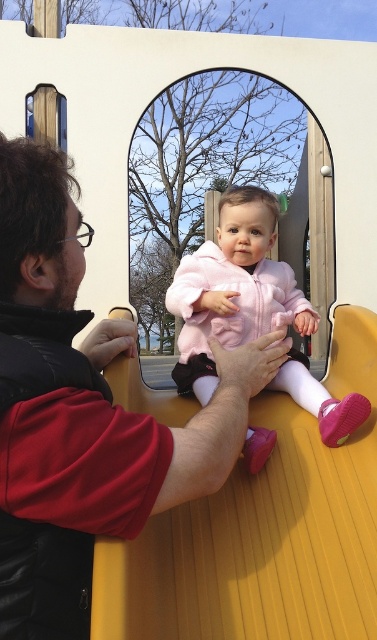
Question: Among these points, which one is nearest to the camera?

Choices:
 (A) (203, 625)
 (B) (73, 385)
 (C) (346, 404)

Answer: (B)

Question: Does matte black jacket at left appear over matte yellow slide at center?

Choices:
 (A) yes
 (B) no

Answer: (A)

Question: Can you confirm if matte yellow slide at center is smaller than pink fleece jacket at center?

Choices:
 (A) no
 (B) yes

Answer: (A)

Question: Is matte black jacket at left to the left of pink fleece jacket at center from the viewer's perspective?

Choices:
 (A) no
 (B) yes

Answer: (B)

Question: Which point is closer to the camera?

Choices:
 (A) (73, 504)
 (B) (136, 616)

Answer: (A)

Question: Which of the following is the farthest from the observer?

Choices:
 (A) (165, 577)
 (B) (171, 291)

Answer: (B)